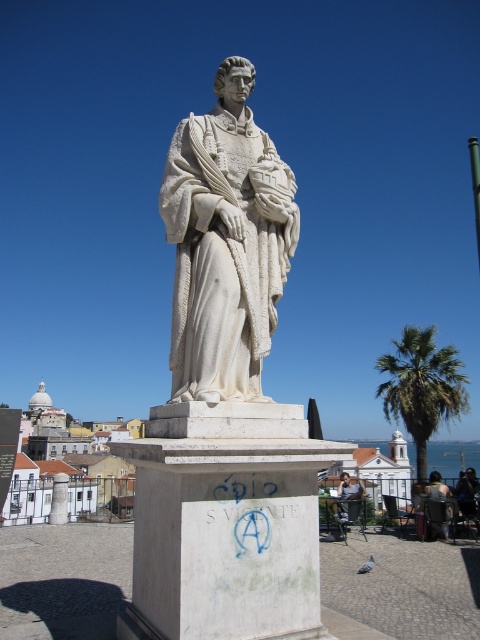
You are a photographer trying to capture the white marble statue at center and the light brown wooden chair at lower right in a single frame. However, the statue is blocking your view of the chair. Is there a way to adjust your position so that both objects are visible without moving either object?

The white marble statue at center is positioned over the light brown wooden chair at lower right, so moving your camera position lower or to the side might allow you to see both objects without obstruction.

You are standing in the plaza in front of the statue. You see a point marked at coordinate (421, 387). What object is located at that point?

The point at (421, 387) indicates a green leafy palm tree at right.

You are standing in the plaza looking at the statue. Where is the dark blue fabric at lower right located in relation to the statue?

The dark blue fabric at lower right is located at the lower right area of the image, near the edge closest to the viewer, positioned at coordinates approximately 0.772 on the x axis and 0.975 on the y axis.